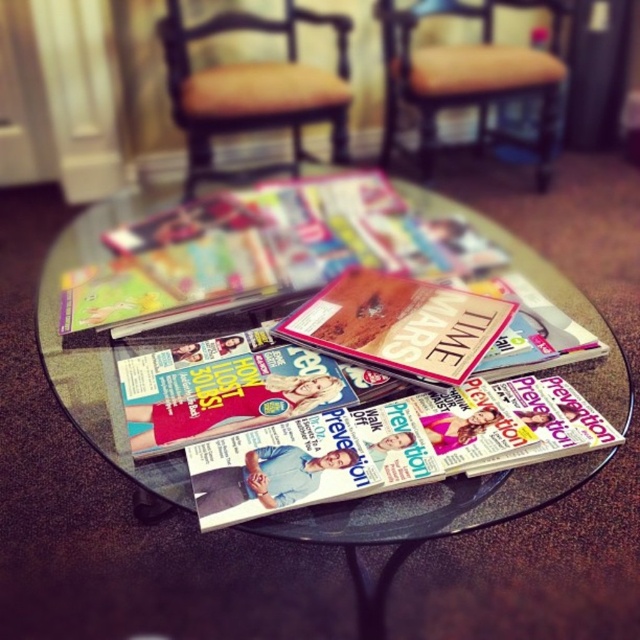
The height and width of the screenshot is (640, 640). What do you see at coordinates (99, 349) in the screenshot? I see `clear glass table at center` at bounding box center [99, 349].

Can you confirm if clear glass table at center is bigger than matte paper prevention magazine at center?

Correct, clear glass table at center is larger in size than matte paper prevention magazine at center.

Who is more distant from viewer, (x=611, y=420) or (x=278, y=426)?

The point (x=611, y=420) is behind.

The width and height of the screenshot is (640, 640). I want to click on clear glass table at center, so click(x=99, y=349).

Does clear glass table at center have a lesser height compared to brown fabric armchair at center?

Indeed, clear glass table at center has a lesser height compared to brown fabric armchair at center.

Can you confirm if clear glass table at center is positioned above brown fabric armchair at center?

No.

Who is more distant from viewer, (456, 493) or (256, 24)?

Positioned behind is point (256, 24).

Identify the location of clear glass table at center. (99, 349).

Between clear glass table at center and matte paper magazine at center, which one has more height?

Standing taller between the two is clear glass table at center.

How far apart are clear glass table at center and matte paper magazine at center?

clear glass table at center and matte paper magazine at center are 8.77 inches apart from each other.

The image size is (640, 640). I want to click on clear glass table at center, so click(99, 349).